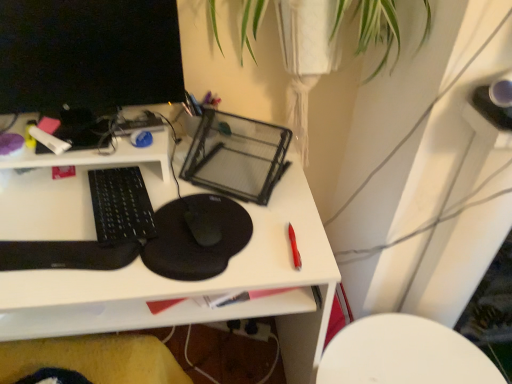
Identify the location of free space to the back side of black matte mouse at center. Image resolution: width=512 pixels, height=384 pixels. (x=206, y=182).